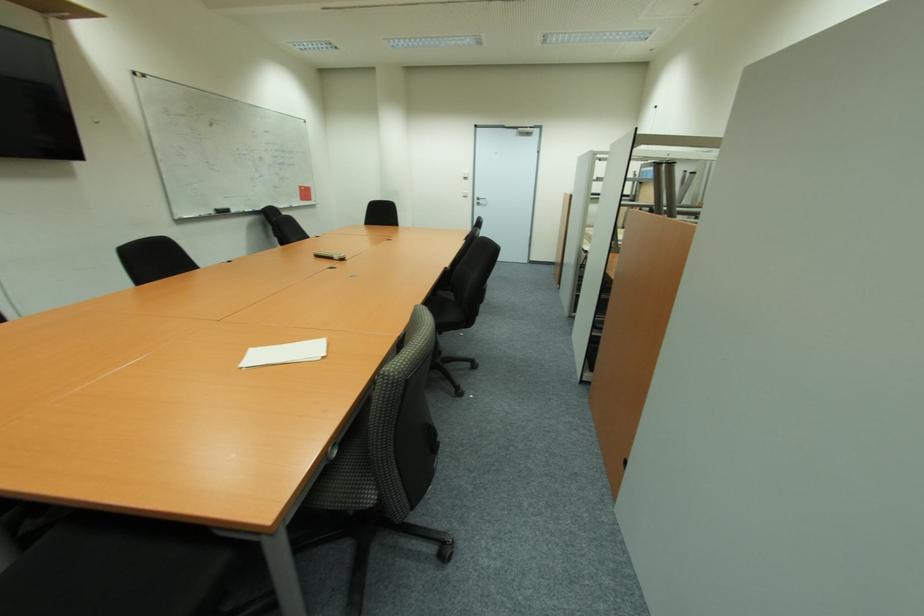
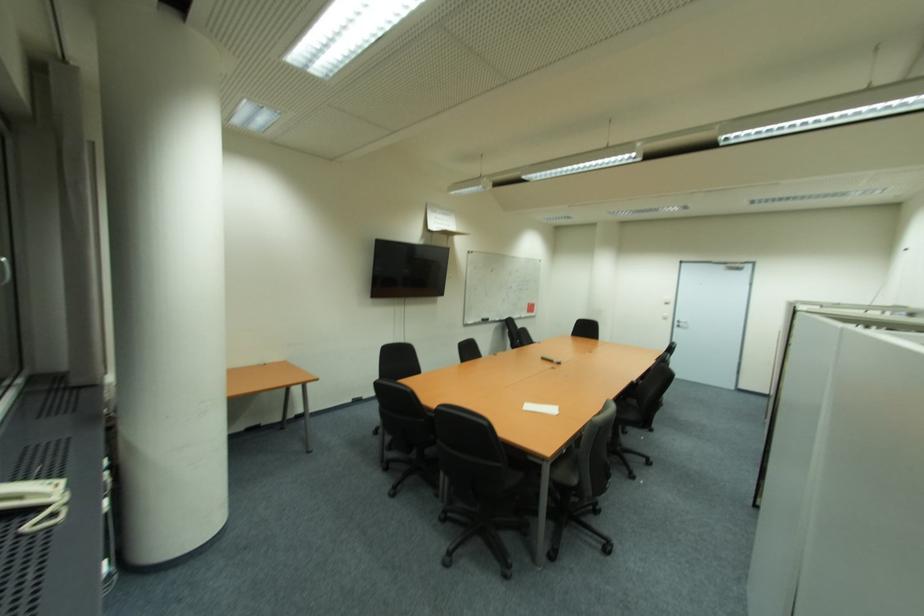
Where in the second image is the point corresponding to pixel 373 499 from the first image?

(578, 482)